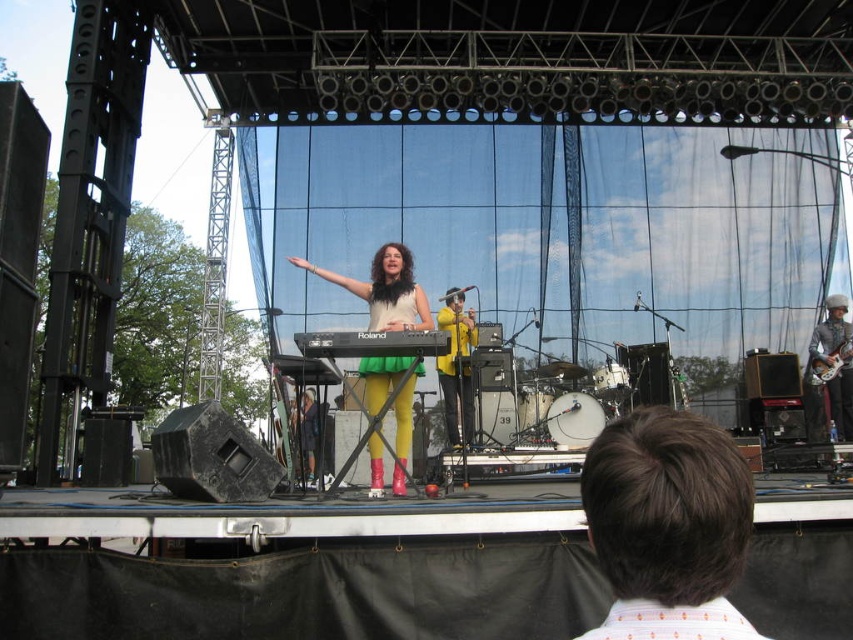
Between yellow matte jacket at center and yellow fabric dress at center, which one is positioned lower?

Positioned lower is yellow fabric dress at center.

Is yellow matte jacket at center thinner than yellow fabric dress at center?

Indeed, yellow matte jacket at center has a lesser width compared to yellow fabric dress at center.

What are the coordinates of `yellow matte jacket at center` in the screenshot? It's located at (456, 365).

Locate an element on the screen. yellow matte jacket at center is located at coordinates (456, 365).

Is yellow matte jacket at center bigger than black plastic keyboard at center?

Actually, yellow matte jacket at center might be smaller than black plastic keyboard at center.

At what (x,y) coordinates should I click in order to perform the action: click on yellow matte jacket at center. Please return your answer as a coordinate pair (x, y). The height and width of the screenshot is (640, 853). Looking at the image, I should click on (456, 365).

Does point (662, 531) come farther from viewer compared to point (315, 426)?

No.

Between point (650, 614) and point (312, 458), which one is positioned behind?

Point (312, 458)

Between point (630, 577) and point (299, 412), which one is positioned in front?

Point (630, 577)

Where is `brown hair at center`? This screenshot has width=853, height=640. brown hair at center is located at coordinates (668, 525).